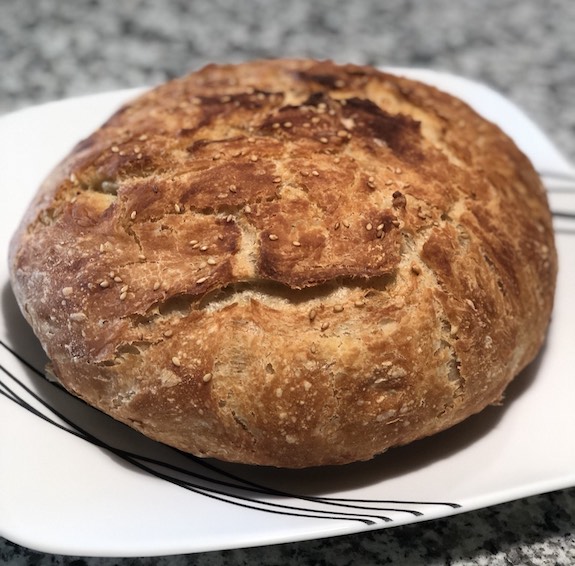
At what (x,y) coordinates should I click in order to perform the action: click on white plate. Please return your answer as a coordinate pair (x, y). Looking at the image, I should click on (94, 523).